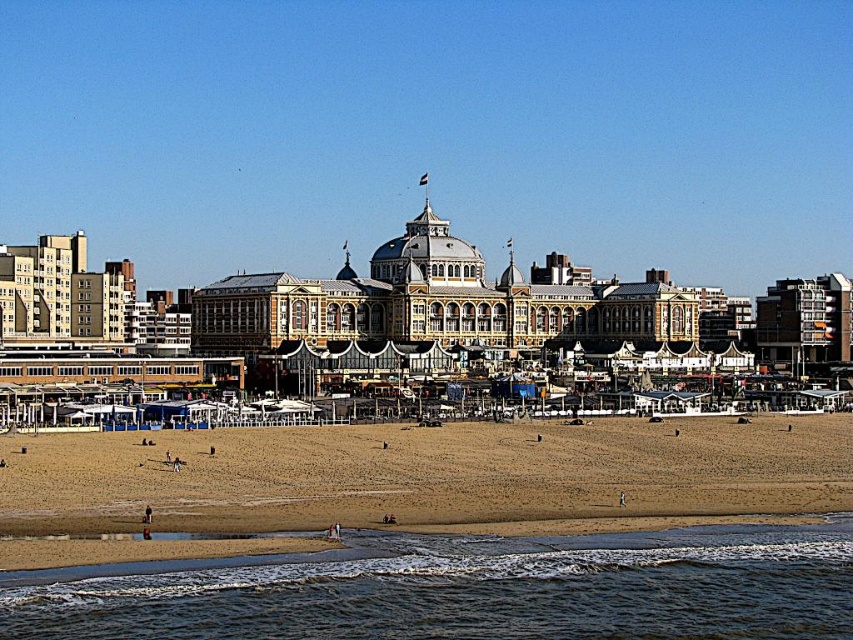
Question: Can you confirm if clear water at lower left is thinner than brown sandy beach at lower center?

Choices:
 (A) yes
 (B) no

Answer: (A)

Question: Which point is farther from the camera taking this photo?

Choices:
 (A) (166, 586)
 (B) (352, 486)

Answer: (B)

Question: Is clear water at lower left further to the viewer compared to brown sandy beach at lower center?

Choices:
 (A) no
 (B) yes

Answer: (A)

Question: Does clear water at lower left have a greater width compared to brown sandy beach at lower center?

Choices:
 (A) yes
 (B) no

Answer: (B)

Question: Which point is closer to the camera?

Choices:
 (A) (329, 444)
 (B) (775, 525)

Answer: (B)